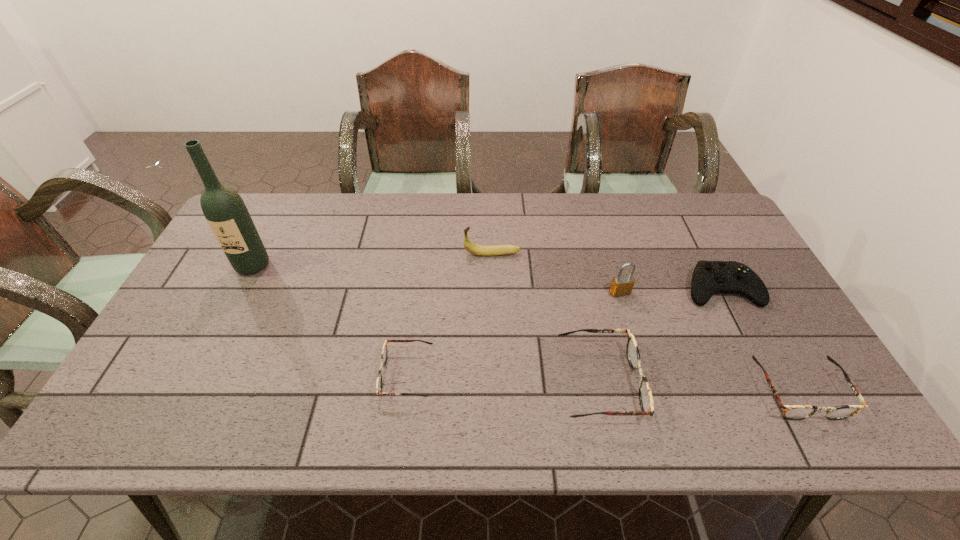
You are a GUI agent. You are given a task and a screenshot of the screen. Output one action in this format:
    pyautogui.click(x=<x>, y=<y>)
    Task: Click on the leftmost spectacles
    The width and height of the screenshot is (960, 540).
    Given the screenshot: What is the action you would take?
    pyautogui.click(x=384, y=354)

Where is `the shortest object`? This screenshot has height=540, width=960. the shortest object is located at coordinates (384, 354).

Find the location of a particular element. The image size is (960, 540). the second spectacles from left to right is located at coordinates (645, 395).

I want to click on the second shortest spectacles, so click(790, 412).

The image size is (960, 540). I want to click on the fifth object from right to left, so click(x=471, y=247).

Where is `control`? control is located at coordinates (709, 277).

At what (x,y) coordinates should I click in order to perform the action: click on wine bottle. Please return your answer as a coordinate pair (x, y). Image resolution: width=960 pixels, height=540 pixels. Looking at the image, I should click on (225, 211).

Where is `the leftmost object`? This screenshot has height=540, width=960. the leftmost object is located at coordinates (225, 211).

Identify the location of padlock. The width and height of the screenshot is (960, 540). (621, 285).

Where is `free space located 0.100m on the frame of the leftmost spectacles`? The height and width of the screenshot is (540, 960). free space located 0.100m on the frame of the leftmost spectacles is located at coordinates (341, 374).